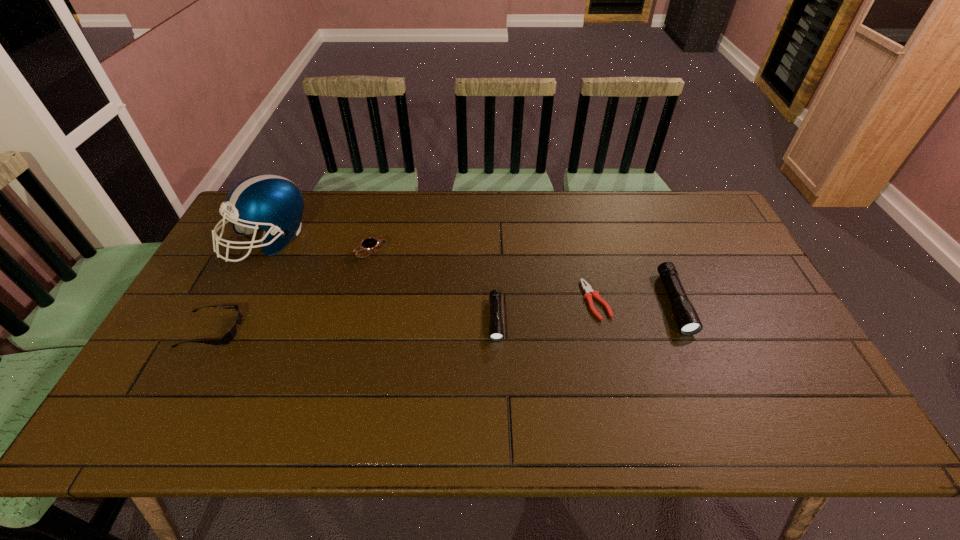
Where is `vacant area situated at the lens end of the right flashlight`? vacant area situated at the lens end of the right flashlight is located at coordinates (708, 387).

The image size is (960, 540). In order to click on free space located at the front of the football helmet with the faceguard in this screenshot , I will do `click(210, 354)`.

In order to click on blank area located 0.390m on the right of the fourth object from right to left in this screenshot , I will do `click(513, 252)`.

This screenshot has width=960, height=540. I want to click on free space located 0.170m on the front of the pliers, so click(x=614, y=377).

At what (x,y) coordinates should I click in order to perform the action: click on vacant space located 0.380m on the front-facing side of the sunglasses. Please return your answer as a coordinate pair (x, y). This screenshot has height=540, width=960. Looking at the image, I should click on (384, 329).

This screenshot has width=960, height=540. In order to click on object present at the far edge in this screenshot , I will do `click(271, 202)`.

In order to click on football helmet that is at the left edge in this screenshot , I will do `click(271, 202)`.

Identify the location of sunglasses present at the left edge. (230, 335).

Where is `object present at the far left corner`? object present at the far left corner is located at coordinates (271, 202).

What are the coordinates of `free location at the far edge` in the screenshot? It's located at (420, 234).